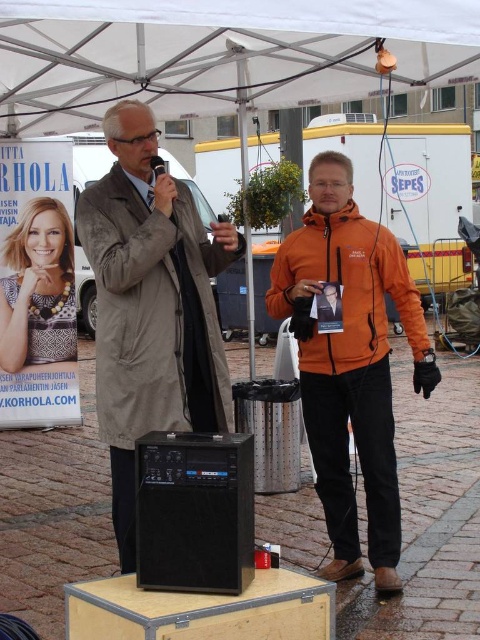
You are a photographer trying to capture a clear shot of the white fabric canopy at upper center and the gray fabric trench coat at upper left. Which object will appear larger in your photo if you frame them both in the same shot?

The gray fabric trench coat at upper left will appear larger in the photo because it is taller than the white fabric canopy at upper center.

Looking at this image, you are attending a public event and notice two people wearing distinctive jackets. The first is a gray fabric trench coat at upper left, and the second is an orange fleece jacket at center. From your perspective, which jacket appears taller?

The gray fabric trench coat at upper left appears taller than the orange fleece jacket at center because it has a greater height compared to the orange fleece jacket at center.

You are attending an outdoor event and notice two people in front of you. One is wearing a gray fabric trench coat at upper left and the other has an orange fleece jacket at center. From your viewpoint, which person is closer to you?

The gray fabric trench coat at upper left is in front of the orange fleece jacket at center, so the person in the gray fabric trench coat at upper left is closer to you.